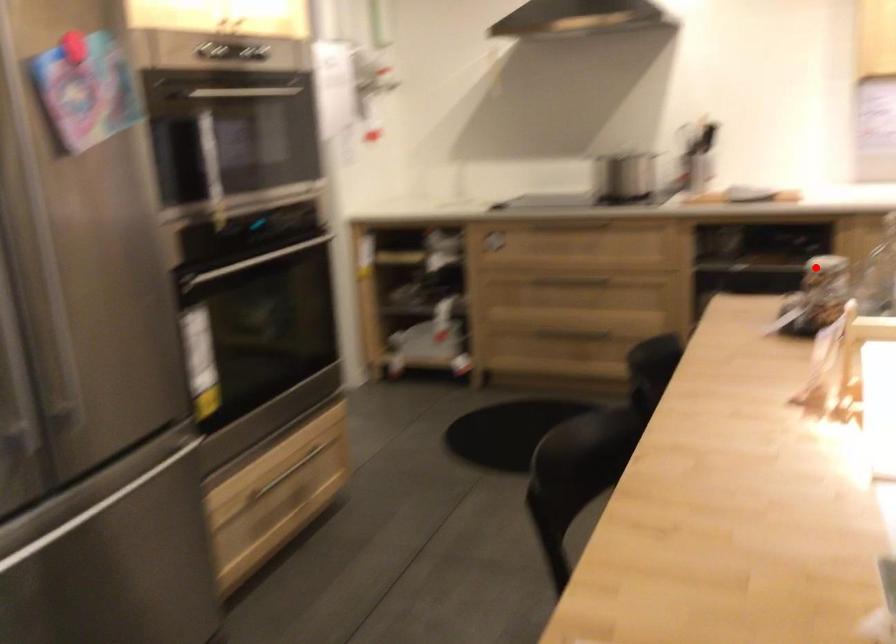
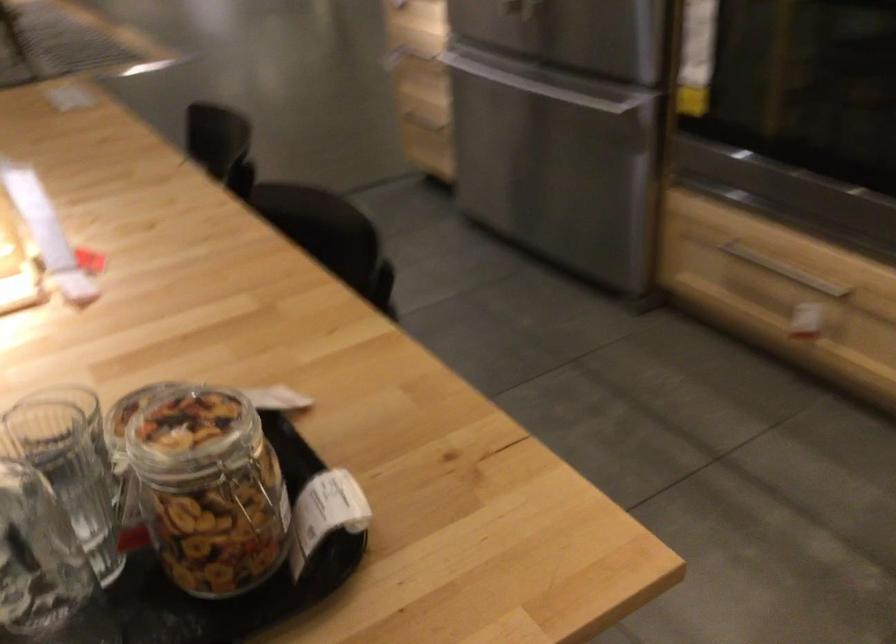
Where in the second image is the point corresponding to the highlighted location from the first image?

(209, 489)